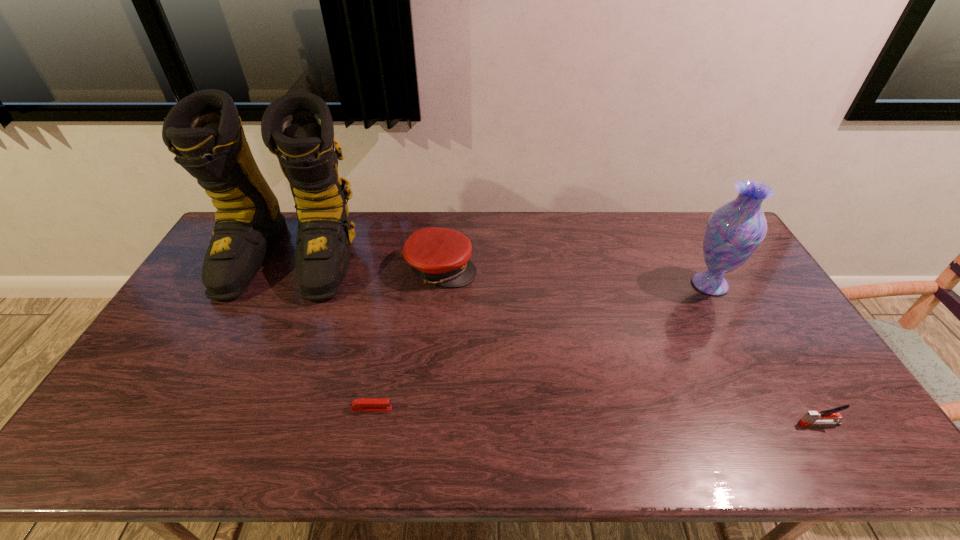
Find the location of a particular element. This screenshot has width=960, height=540. vacant space located 0.120m on the front of the cap with an emblem is located at coordinates (512, 269).

Image resolution: width=960 pixels, height=540 pixels. What are the coordinates of `vacant space located on the handle side of the taller stapler` in the screenshot? It's located at (678, 423).

Where is `vacant space situated 0.290m on the handle side of the taller stapler`? vacant space situated 0.290m on the handle side of the taller stapler is located at coordinates (682, 423).

At what (x,y) coordinates should I click in order to perform the action: click on vacant space located on the handle side of the taller stapler. Please return your answer as a coordinate pair (x, y). The image size is (960, 540). Looking at the image, I should click on (641, 423).

Identify the location of blank space located 0.100m on the front-facing side of the shorter stapler. The height and width of the screenshot is (540, 960). (431, 409).

What are the coordinates of `ski boots located in the far edge section of the desktop` in the screenshot? It's located at (204, 131).

The width and height of the screenshot is (960, 540). In order to click on cap located in the far edge section of the desktop in this screenshot , I will do `click(441, 256)`.

The image size is (960, 540). In order to click on object located at the left edge in this screenshot , I will do `click(204, 131)`.

Where is `vase that is at the right edge`? vase that is at the right edge is located at coordinates click(x=734, y=231).

Identify the location of stapler at the right edge. Image resolution: width=960 pixels, height=540 pixels. (828, 417).